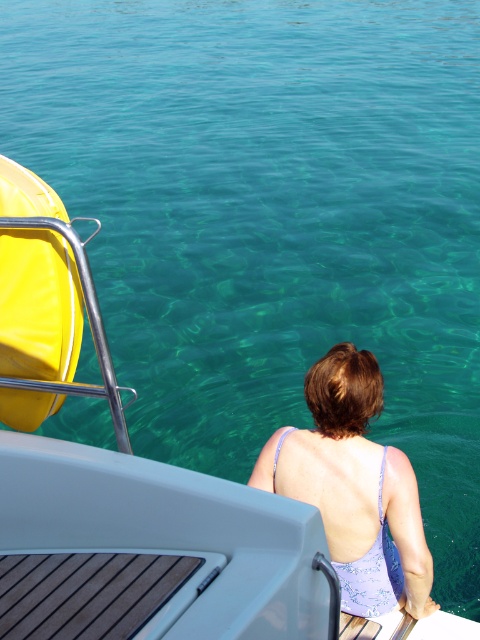
Between purple fabric swimsuit at center and matte yellow life jacket at left, which one is positioned higher?

matte yellow life jacket at left

Does purple fabric swimsuit at center have a smaller size compared to matte yellow life jacket at left?

No.

Which is in front, point (410, 522) or point (82, 308)?

Point (82, 308) is more forward.

Where is `purple fabric swimsuit at center`? The width and height of the screenshot is (480, 640). purple fabric swimsuit at center is located at coordinates (355, 486).